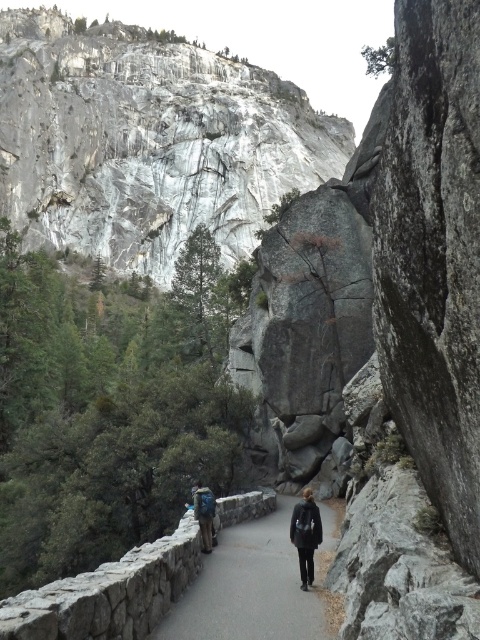
You are a hiker standing on the trail and want to take a photo of both the point at (226, 104) and the point at (204, 520). Since you want both points to be in focus, which point should you focus on first?

You should focus on the point at (204, 520) first because it is closer to you than the point at (226, 104), so focusing on the closer point will ensure the farther point is also in focus.

You are a hiker standing at the starting point of the trail. You spot two points marked on the trail ahead of you. The first point is at coordinates point (x=304, y=525) and the second is at point (x=197, y=492). Which point will you reach first as you begin walking along the trail?

Point (x=304, y=525) is closer to the camera than point (x=197, y=492), so you will reach point (x=304, y=525) first as you walk along the trail.

You are a hiker standing on the trail and want to take a photo of both the white marble mountain at upper center and the blue fabric backpack at center. Which object should you focus on first to ensure it appears larger in your photo?

The white marble mountain at upper center is taller than the blue fabric backpack at center, so you should focus on the white marble mountain at upper center first to capture its full height in the photo.